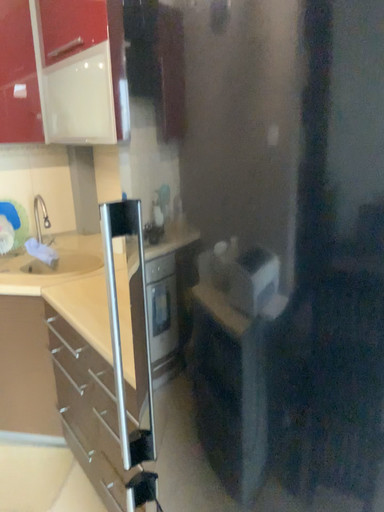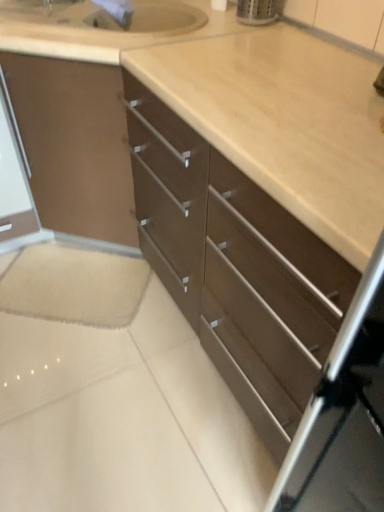
Question: Which way did the camera rotate in the video?

Choices:
 (A) rotated upward
 (B) rotated downward

Answer: (B)